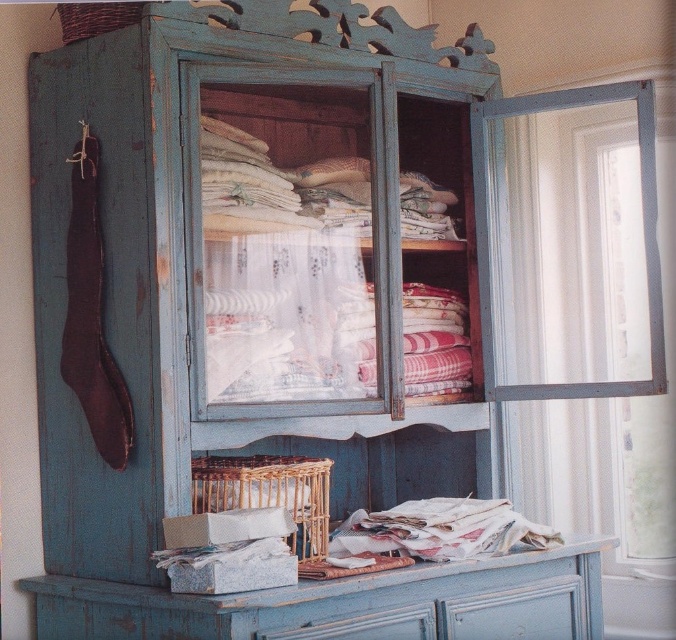
Between woven wicker basket at center and distressed blue drawer at lower center, which one appears on the right side from the viewer's perspective?

Positioned to the right is distressed blue drawer at lower center.

Can you confirm if woven wicker basket at center is positioned to the left of distressed blue drawer at lower center?

Correct, you'll find woven wicker basket at center to the left of distressed blue drawer at lower center.

Who is more distant from viewer, (324, 472) or (535, 595)?

Positioned behind is point (535, 595).

This screenshot has height=640, width=676. Identify the location of woven wicker basket at center. (268, 492).

Which is above, distressed blue drawer at lower center or woven brown basket at upper left?

woven brown basket at upper left is higher up.

Does distressed blue drawer at lower center have a greater height compared to woven brown basket at upper left?

Yes, distressed blue drawer at lower center is taller than woven brown basket at upper left.

Is point (550, 588) closer to viewer compared to point (124, 13)?

No, it is not.

The width and height of the screenshot is (676, 640). I want to click on distressed blue drawer at lower center, so click(x=516, y=612).

Can you confirm if woven wicker basket at center is smaller than woven brown basket at upper left?

No.

Which is above, woven wicker basket at center or woven brown basket at upper left?

woven brown basket at upper left is higher up.

Between point (293, 477) and point (93, 3), which one is positioned behind?

The point (293, 477) is more distant.

The image size is (676, 640). Identify the location of woven wicker basket at center. (268, 492).